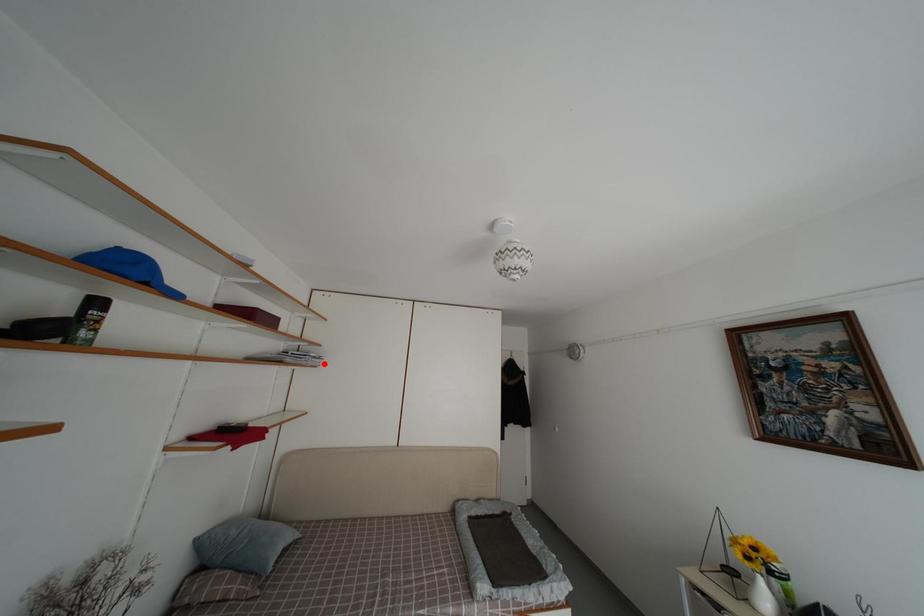
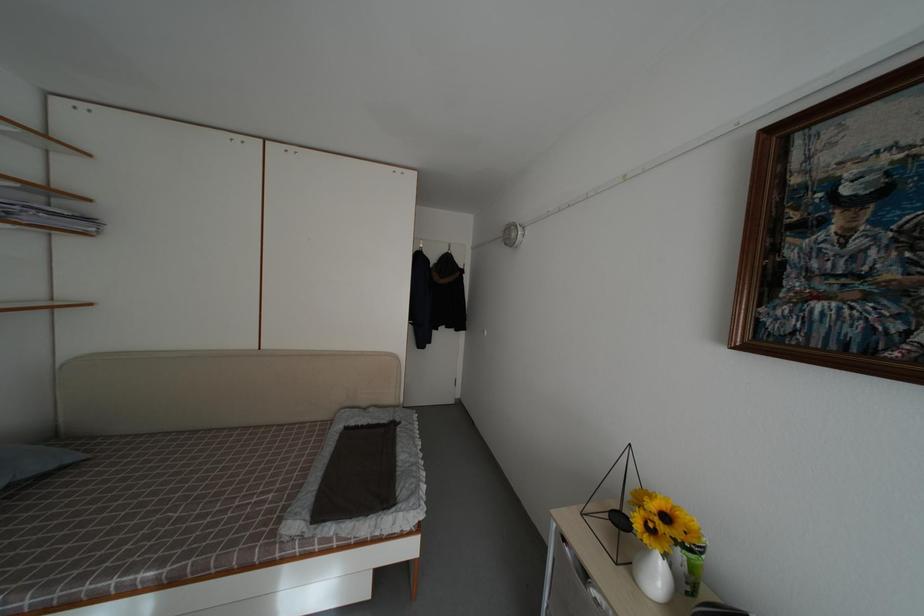
Where in the second image is the point corresponding to the highlighted location from the first image?

(94, 225)